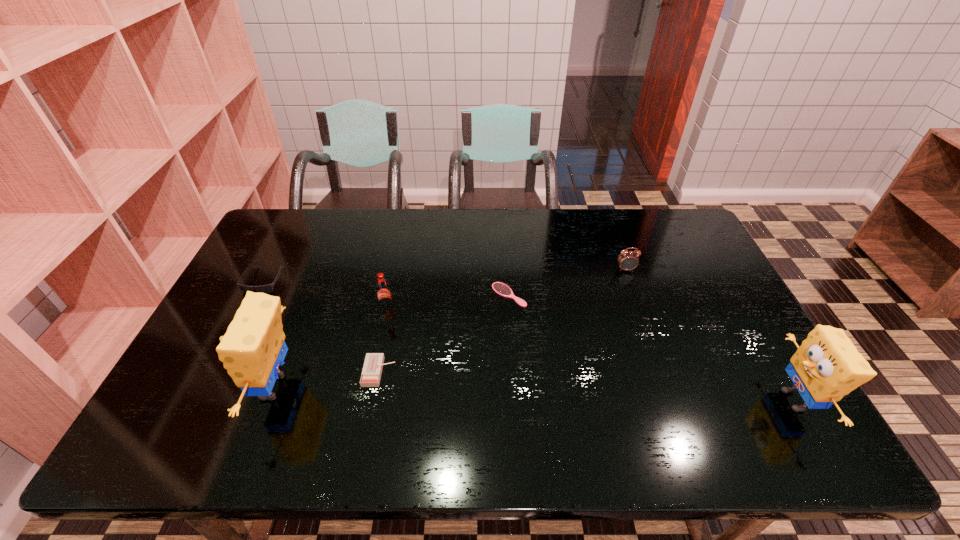
The image size is (960, 540). Find the location of `vacant region at the right edge of the desktop`. vacant region at the right edge of the desktop is located at coordinates (699, 302).

This screenshot has height=540, width=960. In the image, there is a desktop. Find the location of `free space at the far left corner`. free space at the far left corner is located at coordinates (312, 224).

The height and width of the screenshot is (540, 960). In the image, there is a desktop. Find the location of `vacant region at the near left corner`. vacant region at the near left corner is located at coordinates (193, 396).

The width and height of the screenshot is (960, 540). I want to click on free space at the far right corner, so [x=668, y=211].

In the image, there is a desktop. Find the location of `vacant area at the near right corner`. vacant area at the near right corner is located at coordinates (780, 404).

Where is `free space between the root beer and the shortest object`? The height and width of the screenshot is (540, 960). free space between the root beer and the shortest object is located at coordinates (448, 302).

At what (x,y) coordinates should I click in order to perform the action: click on free spot between the third tallest object and the sixth tallest object. Please return your answer as a coordinate pair (x, y). This screenshot has width=960, height=540. Looking at the image, I should click on (383, 340).

You are a GUI agent. You are given a task and a screenshot of the screen. Output one action in this format:
    pyautogui.click(x=<x>, y=<y>)
    Task: Click on the free space between the sixth tallest object and the fifth tallest object
    
    Given the screenshot: What is the action you would take?
    pyautogui.click(x=322, y=326)

At what (x,y) coordinates should I click in order to perform the action: click on vacant space that is in between the matchbox and the sunglasses. Please return your answer as a coordinate pair (x, y). This screenshot has width=960, height=540. Looking at the image, I should click on (322, 326).

The width and height of the screenshot is (960, 540). I want to click on unoccupied area between the right sponge and the left sponge, so click(534, 394).